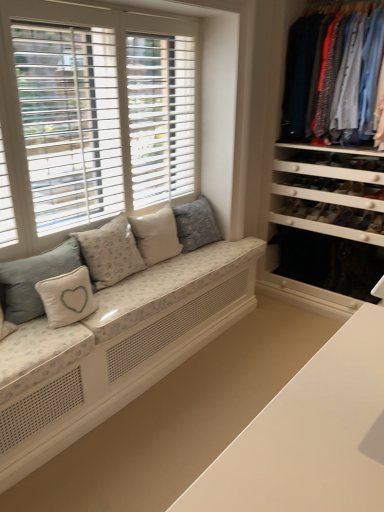
Question: Considering the relative sizes of light beige fabric pillow at center, marked as the fourth pillow in a left-to-right arrangement, and floral fabric cushion at center, which appears as the 5th pillow when viewed from the left, in the image provided, is light beige fabric pillow at center, marked as the fourth pillow in a left-to-right arrangement, taller than floral fabric cushion at center, which appears as the 5th pillow when viewed from the left,?

Choices:
 (A) no
 (B) yes

Answer: (A)

Question: Does light beige fabric pillow at center, marked as the fourth pillow in a left-to-right arrangement, turn towards floral fabric cushion at center, which appears as the 5th pillow when viewed from the left?

Choices:
 (A) no
 (B) yes

Answer: (A)

Question: Does light beige fabric pillow at center, which ranks as the second pillow in right-to-left order, appear on the right side of floral fabric cushion at center, which appears as the 5th pillow when viewed from the left?

Choices:
 (A) no
 (B) yes

Answer: (A)

Question: Can you see light beige fabric pillow at center, marked as the fourth pillow in a left-to-right arrangement, touching floral fabric cushion at center, which appears as the 5th pillow when viewed from the left?

Choices:
 (A) yes
 (B) no

Answer: (B)

Question: Is light beige fabric pillow at center, marked as the fourth pillow in a left-to-right arrangement, looking in the opposite direction of floral fabric cushion at center, acting as the first pillow starting from the right?

Choices:
 (A) no
 (B) yes

Answer: (A)

Question: Does light beige fabric pillow at center, marked as the fourth pillow in a left-to-right arrangement, have a lesser width compared to floral fabric cushion at center, which appears as the 5th pillow when viewed from the left?

Choices:
 (A) yes
 (B) no

Answer: (A)

Question: Does light beige fabric pillow with heart design at center-left, which appears as the 3th pillow when viewed from the right, have a greater height compared to light blue cotton shirts at right?

Choices:
 (A) no
 (B) yes

Answer: (A)

Question: Can you confirm if light beige fabric pillow with heart design at center-left, which appears as the 3th pillow when viewed from the right, is smaller than light blue cotton shirts at right?

Choices:
 (A) yes
 (B) no

Answer: (A)

Question: Would you consider light beige fabric pillow with heart design at center-left, the 3th pillow when ordered from left to right, to be distant from light blue cotton shirts at right?

Choices:
 (A) no
 (B) yes

Answer: (B)

Question: Is light beige fabric pillow with heart design at center-left, the 3th pillow when ordered from left to right, surrounding light blue cotton shirts at right?

Choices:
 (A) yes
 (B) no

Answer: (B)

Question: Considering the relative positions of light beige fabric pillow with heart design at center-left, which appears as the 3th pillow when viewed from the right, and light blue cotton shirts at right in the image provided, is light beige fabric pillow with heart design at center-left, which appears as the 3th pillow when viewed from the right, in front of light blue cotton shirts at right?

Choices:
 (A) yes
 (B) no

Answer: (A)

Question: Is light beige fabric pillow with heart design at center-left, the 3th pillow when ordered from left to right, looking in the opposite direction of light blue cotton shirts at right?

Choices:
 (A) no
 (B) yes

Answer: (A)

Question: Can we say light blue cotton shirts at right lies outside light beige fabric pillow at center, which ranks as the second pillow in right-to-left order?

Choices:
 (A) no
 (B) yes

Answer: (B)